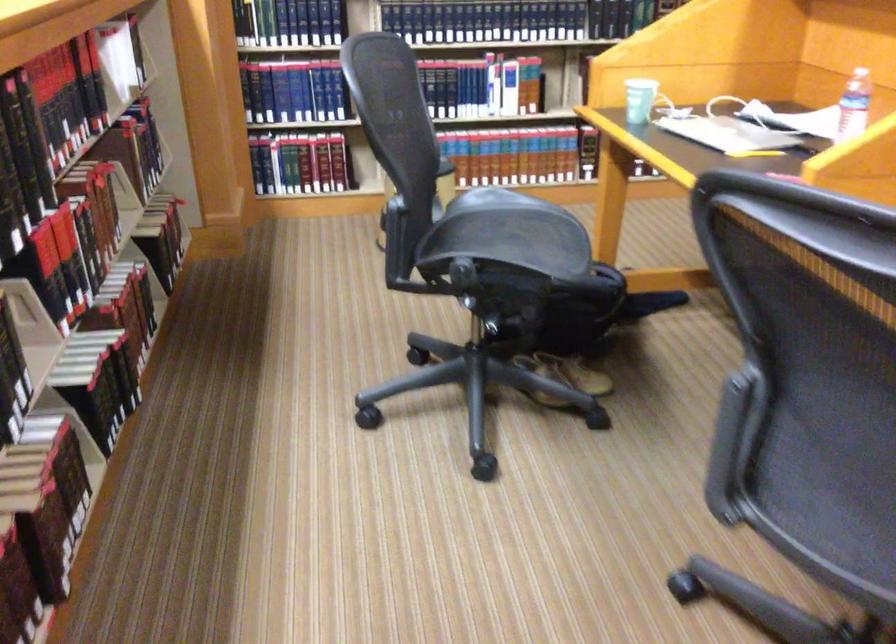
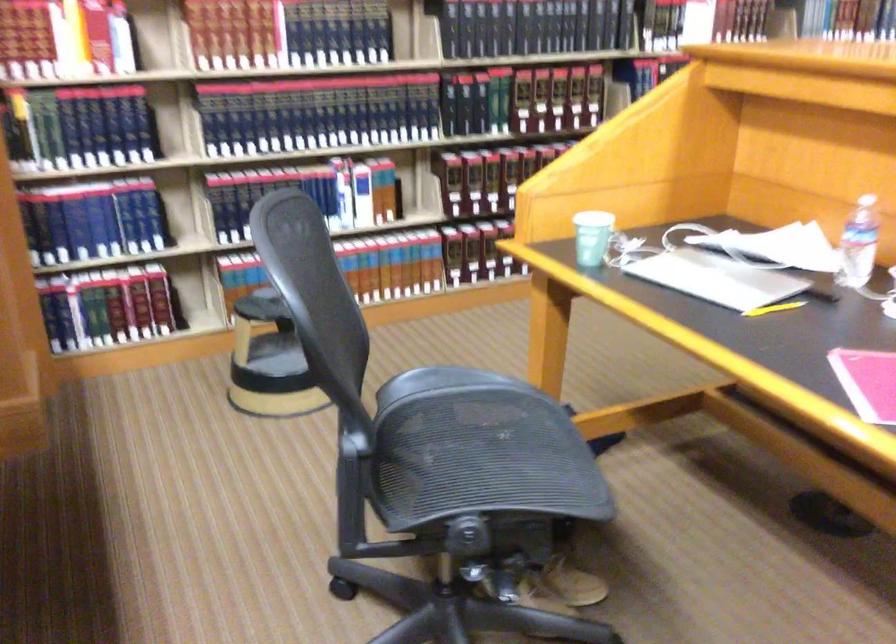
In the second image, find the point that corresponds to point 640,97 in the first image.

(591, 237)